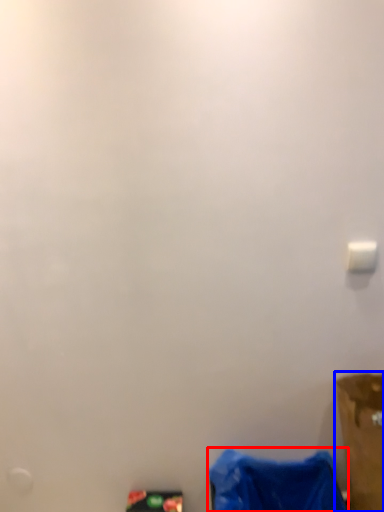
Question: Which object appears closest to the camera in this image, waste (highlighted by a red box) or furniture (highlighted by a blue box)?

Choices:
 (A) waste
 (B) furniture

Answer: (B)